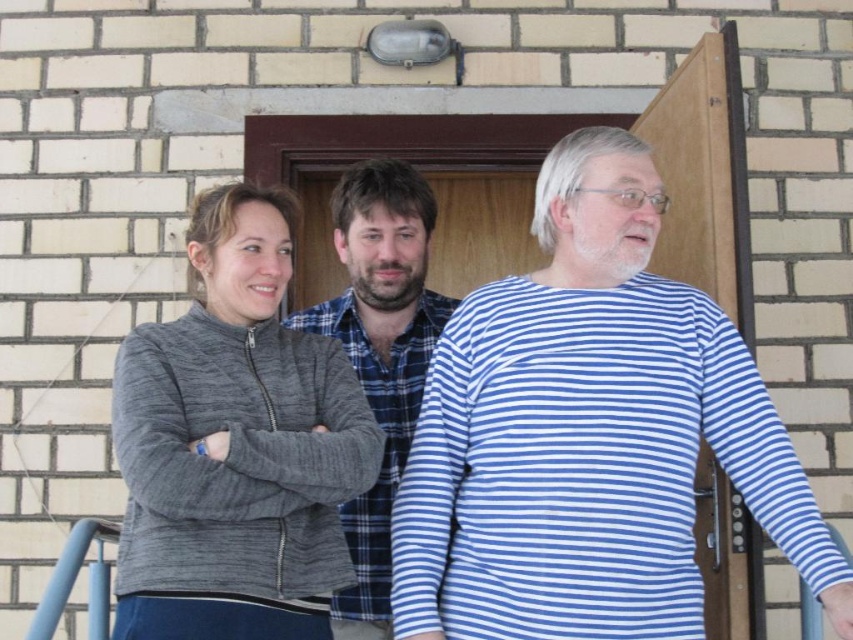
You are a photographer setting up a tripod to take a group photo of the people in front of the brick wall. The blue striped shirt at center and the gray textured sweater at center are both in the frame. Based on their heights, which person should you position closer to the back to ensure both are fully visible in the photo?

The blue striped shirt at center is much taller than the gray textured sweater at center, so you should position the blue striped shirt at center closer to the back to ensure both are fully visible in the photo.

Please describe the location of the blue striped shirt at center in the image using coordinates. The coordinate system has the origin at the bottom left corner of the image, with the x and y axes increasing to the right and up respectively. The maximum x and y values are both 1.0. Please provide the coordinates as a pair of numbers between 0.0 and 1.0, separated by a comma.

The blue striped shirt at center is located at coordinates [589,435].